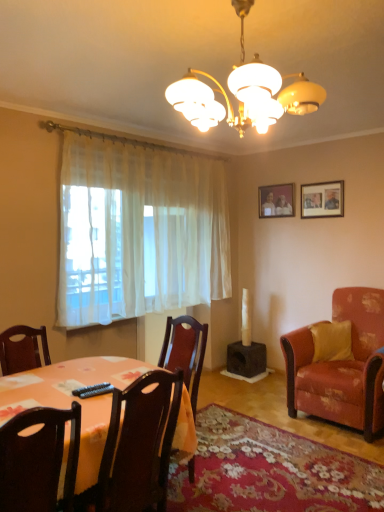
Find the location of a particular element. The height and width of the screenshot is (512, 384). vacant space to the right of dark wood chair at center, the second chair viewed from the right is located at coordinates (231, 482).